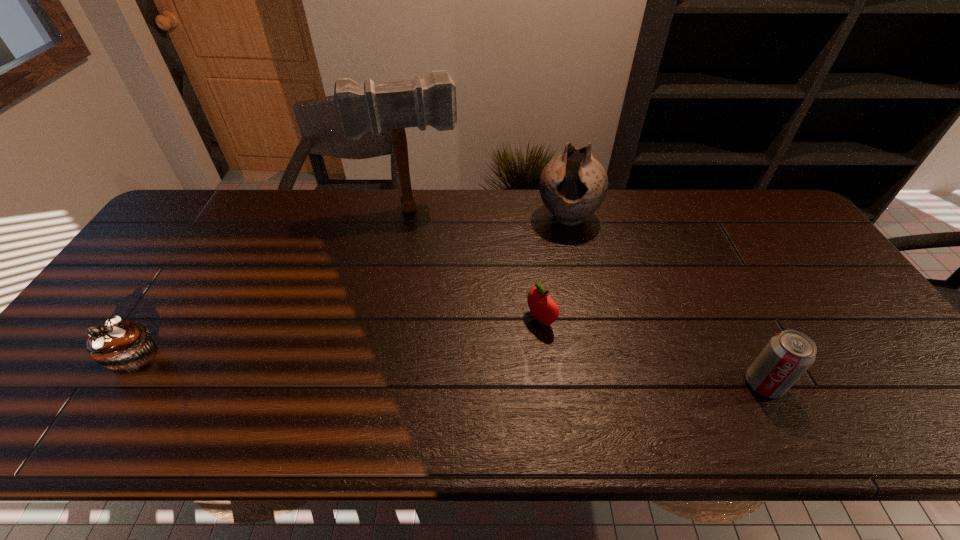
The image size is (960, 540). In order to click on object that can be found as the second closest to the apple in this screenshot , I will do `click(396, 105)`.

Select which object appears as the second closest to the fourth object from right to left. Please provide its 2D coordinates. Your answer should be formatted as a tuple, i.e. [(x, y)], where the tuple contains the x and y coordinates of a point satisfying the conditions above.

[(543, 307)]

Image resolution: width=960 pixels, height=540 pixels. I want to click on free space that satisfies the following two spatial constraints: 1. on the front side of the leftmost object; 2. on the right side of the third shortest object, so click(118, 384).